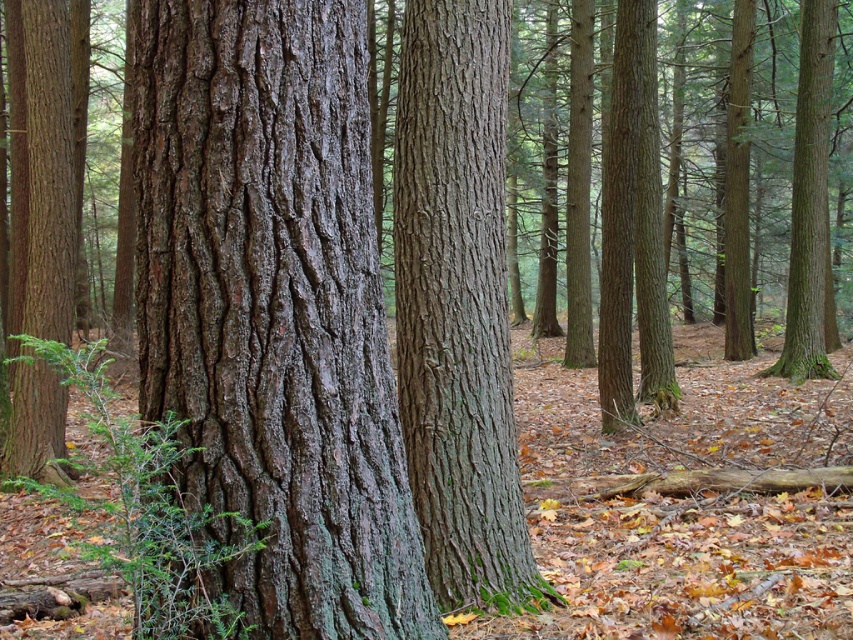
You are standing in the forest and see the smooth bark tree trunk at center. If you want to walk directly towards it from your current position, which direction should you move relative to your current facing direction?

Since the smooth bark tree trunk at center is located at point (457, 305) in 2D coordinates, you should move forward to reach it directly.

You are an arborist inspecting two tree trunks in a forest. You notice the dark brown rough bark at center and the smooth bark tree trunk at center. Which of these two trunks is shorter?

The dark brown rough bark at center is shorter than the smooth bark tree trunk at center.